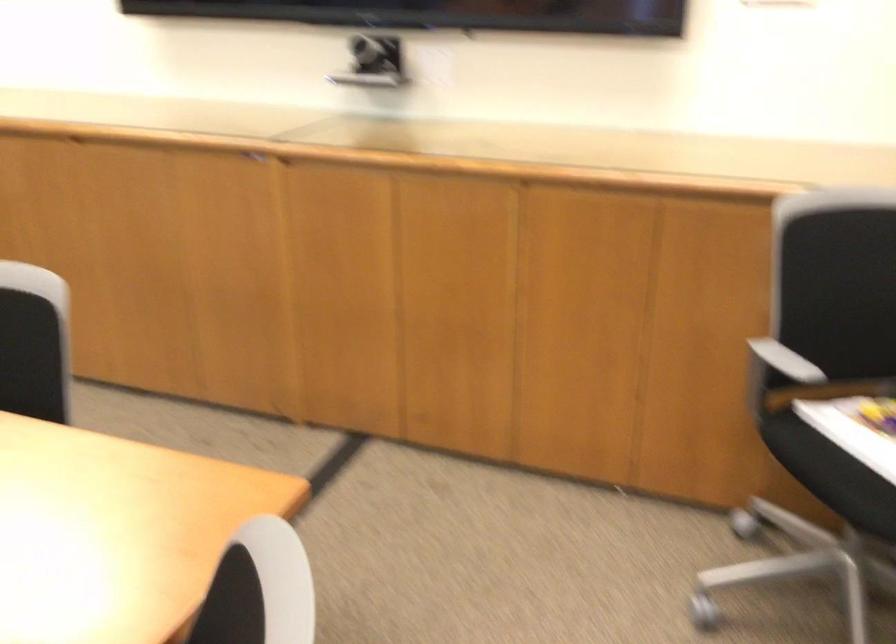
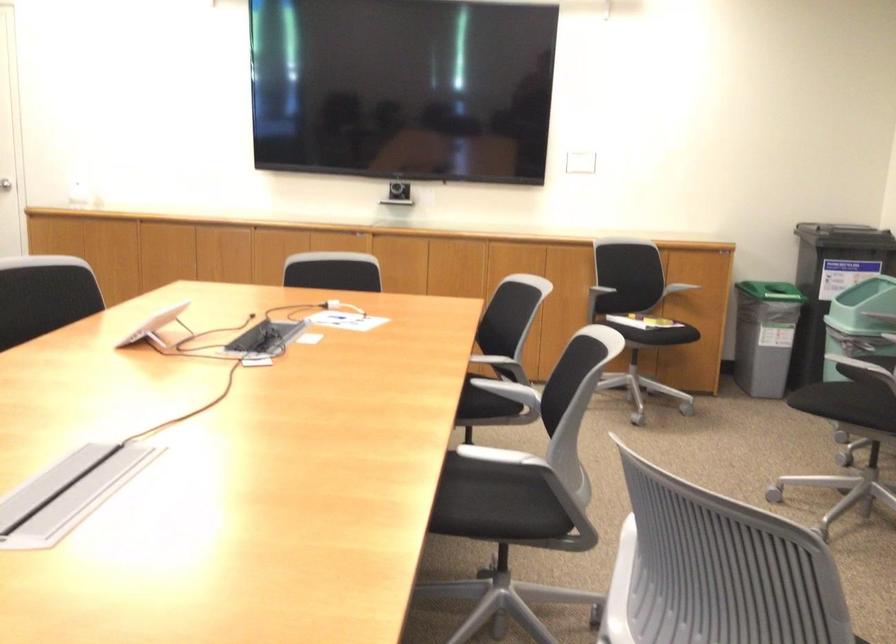
Locate, in the second image, the point that corresponds to (x=711, y=373) in the first image.

(571, 290)